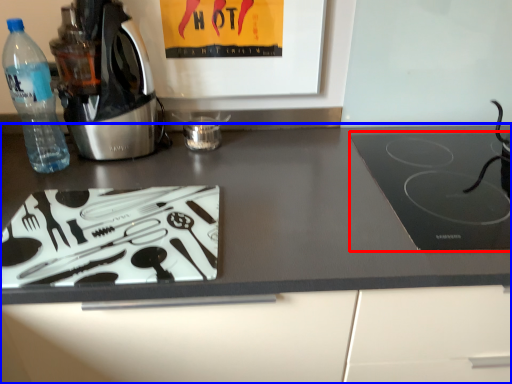
Question: Which object is closer to the camera taking this photo, kitchen appliance (highlighted by a red box) or countertop (highlighted by a blue box)?

Choices:
 (A) kitchen appliance
 (B) countertop

Answer: (B)